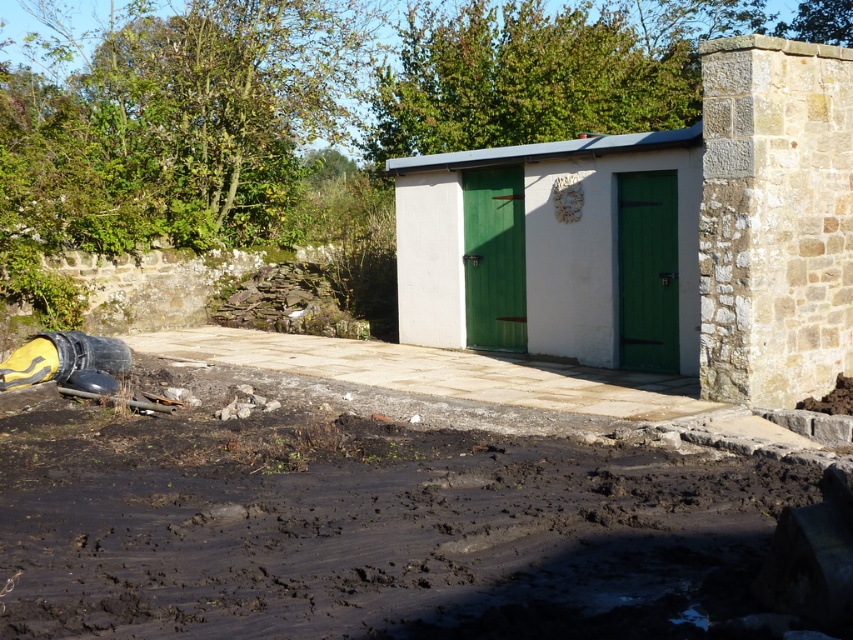
You are standing at the point marked as point (375, 525) in the image. What type of surface are you currently standing on?

The point (375, 525) is on damp brown dirt at lower center, so you are standing on damp brown dirt.

You are a gardener planning to plant a row of flowers in the damp brown dirt at lower center near the white painted wood shed at center. Considering their sizes, which area will require more seeds?

The damp brown dirt at lower center is larger in size than the white painted wood shed at center, so planting flowers there will require more seeds.

You are a gardener who wants to plant flowers in the damp brown dirt at lower center. However, you need to access the area behind the white wood shed at center. Can you walk around the shed to reach the back side?

The damp brown dirt at lower center is below white wood shed at center, so you cannot walk around the shed to reach the back side because the dirt is directly underneath it, blocking access.